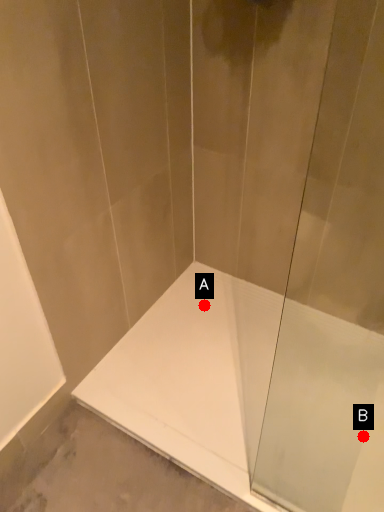
Question: Two points are circled on the image, labeled by A and B beside each circle. Which of the following is the farthest from the observer?

Choices:
 (A) A is further
 (B) B is further

Answer: (A)